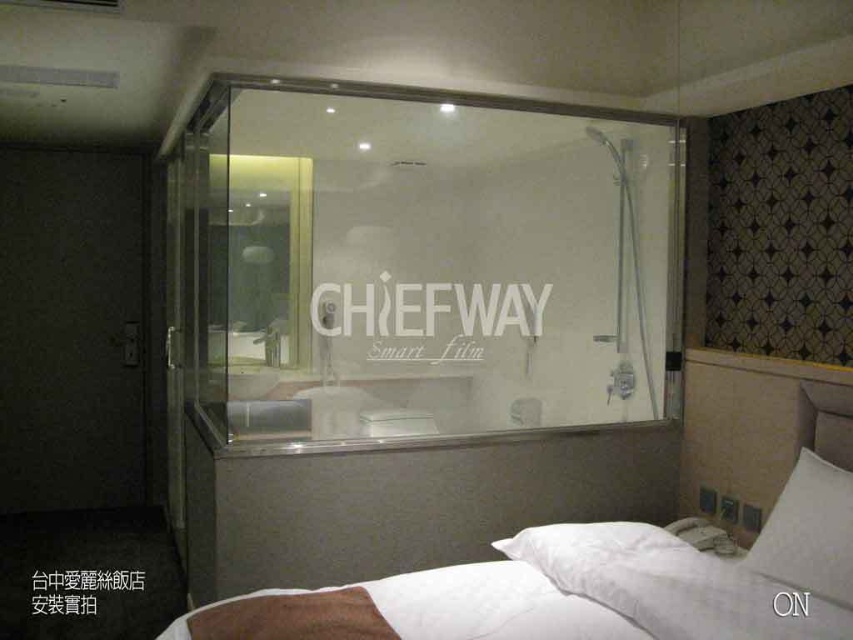
You are a hotel guest who wants to ensure privacy while using the transparent glass shower at center. You notice the matte black door at left is adjacent to the shower. Considering their heights, which one is taller and could potentially block the view from the door?

The matte black door at left is taller than the transparent glass shower at center, so it could potentially block the view from the door.

You are a hotel guest who wants to place a rectangular travel pillow on the bed. The travel pillow is the same size as the white soft pillow at lower right. Will the white soft bed at center have enough space to accommodate the travel pillow without overlapping the existing pillow?

The white soft bed at center has a larger size compared to the white soft pillow at lower right, so there should be enough space to place the travel pillow without overlapping the existing pillow.

You are standing in the hotel room and want to locate the transparent glass shower at center. According to the room layout, where would you find it?

The transparent glass shower at center is located at point (426, 262) in the room layout.